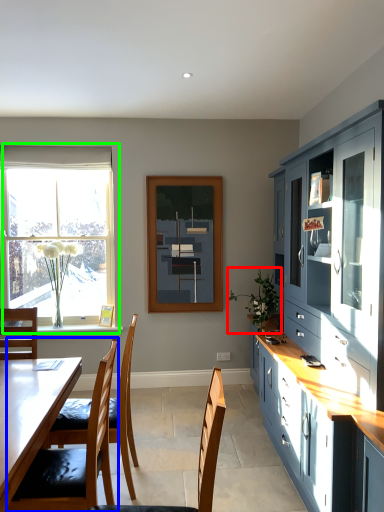
Question: Which is farther away from plant (highlighted by a red box)? chair (highlighted by a blue box) or window (highlighted by a green box)?

Choices:
 (A) chair
 (B) window

Answer: (B)